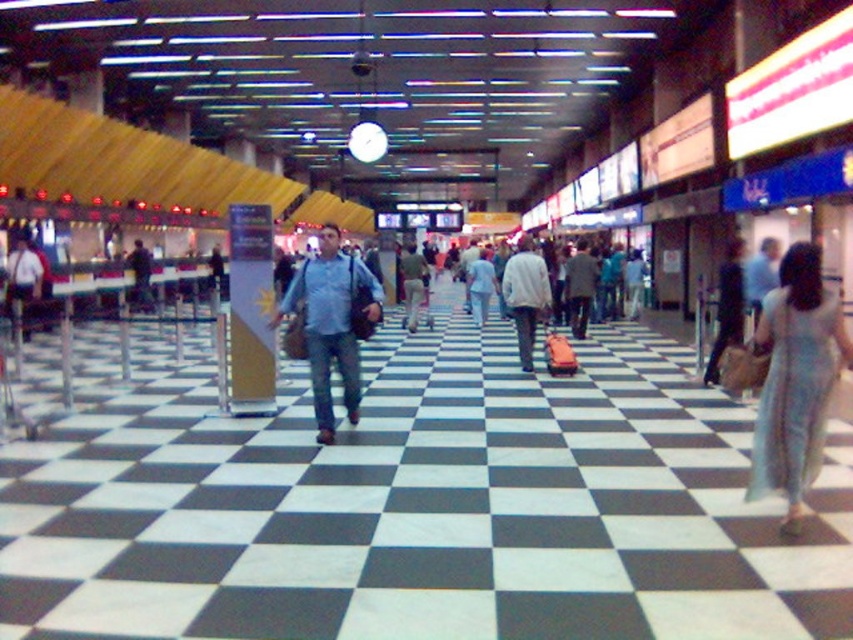
Which of these two, light blue dress at center or light gray sweater at center, stands taller?

light gray sweater at center

Who is higher up, light blue dress at center or light gray sweater at center?

light gray sweater at center is higher up.

Image resolution: width=853 pixels, height=640 pixels. Identify the location of light blue dress at center. (795, 380).

What are the coordinates of `light blue dress at center` in the screenshot? It's located at (795, 380).

Identify the location of light gray sweater at center. (525, 296).

Who is more distant from viewer, (x=521, y=324) or (x=735, y=262)?

The point (x=521, y=324) is more distant.

Image resolution: width=853 pixels, height=640 pixels. Identify the location of light gray sweater at center. (525, 296).

Does matte blue shirt at center appear over light blue denim jeans at center?

Answer: No, matte blue shirt at center is not above light blue denim jeans at center.

Which of these two, matte blue shirt at center or light blue denim jeans at center, stands shorter?

Standing shorter between the two is light blue denim jeans at center.

Locate an element on the screen. matte blue shirt at center is located at coordinates (332, 323).